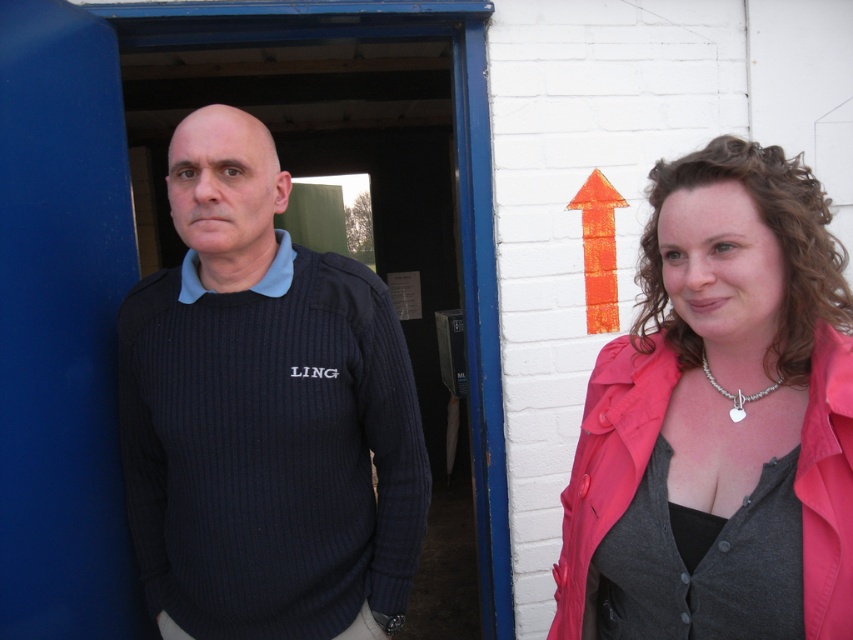
Between point (281, 416) and point (584, 268), which one is positioned behind?

The point (584, 268) is more distant.

Which is below, dark blue ribbed sweater at center or orange textured arrow at upper center?

dark blue ribbed sweater at center is lower down.

Does point (227, 636) come farther from viewer compared to point (601, 291)?

No, it is in front of (601, 291).

Where is `dark blue ribbed sweater at center`? dark blue ribbed sweater at center is located at coordinates (264, 413).

Between point (778, 228) and point (601, 240), which one is positioned behind?

The point (601, 240) is more distant.

Is point (664, 269) positioned after point (584, 180)?

That is False.

Where is `pink fabric at upper right`? pink fabric at upper right is located at coordinates (718, 419).

How much distance is there between knitted dark blue sweater at left and orange textured arrow at upper center?

The distance of knitted dark blue sweater at left from orange textured arrow at upper center is 3.40 feet.

In the scene shown: Does knitted dark blue sweater at left appear on the right side of orange textured arrow at upper center?

In fact, knitted dark blue sweater at left is to the left of orange textured arrow at upper center.

Measure the distance between knitted dark blue sweater at left and camera.

They are 4.28 feet apart.

At what (x,y) coordinates should I click in order to perform the action: click on knitted dark blue sweater at left. Please return your answer as a coordinate pair (x, y). This screenshot has height=640, width=853. Looking at the image, I should click on (720, 422).